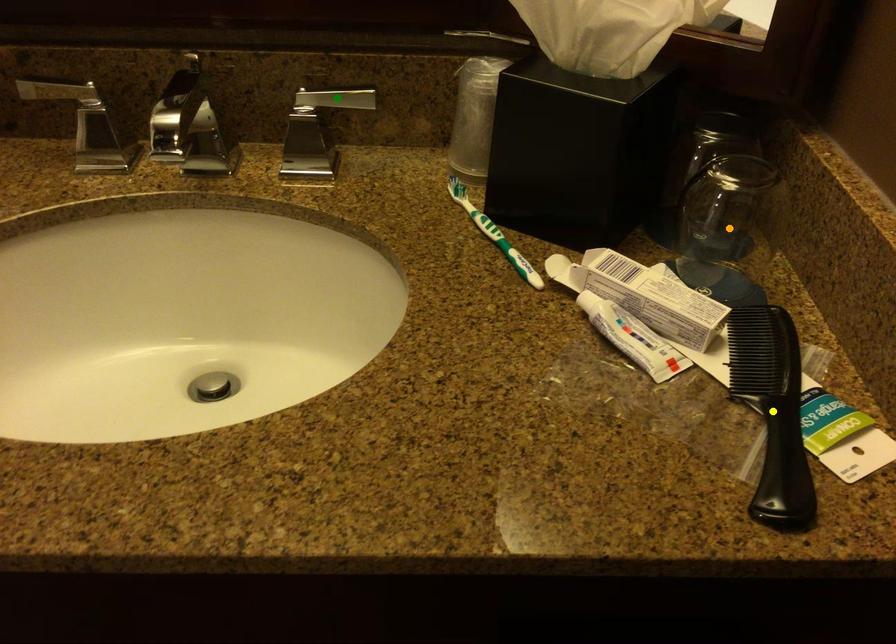
Order these from nearest to farthest:
A) yellow point
B) green point
C) orange point

green point → orange point → yellow point